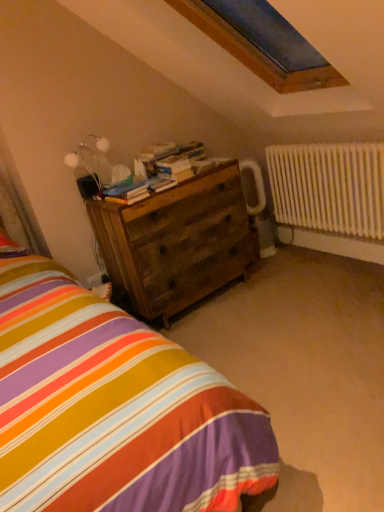
The image size is (384, 512). What are the coordinates of `vacant space in front of wooden chest of drawers at center` in the screenshot? It's located at (235, 333).